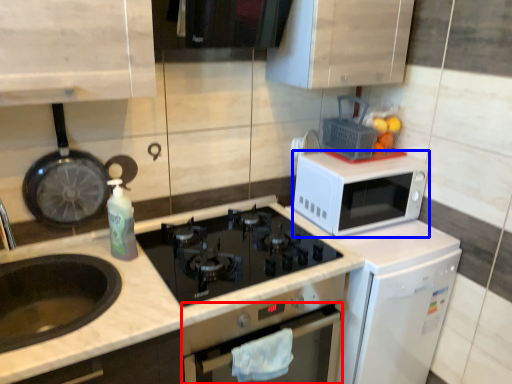
Question: Which of the following is the farthest to the observer, oven (highlighted by a red box) or microwave oven (highlighted by a blue box)?

Choices:
 (A) oven
 (B) microwave oven

Answer: (B)